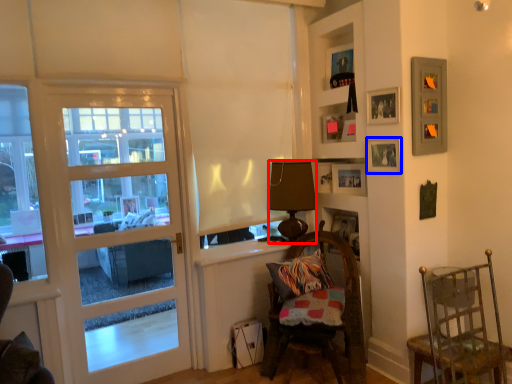
Question: Which object appears farthest to the camera in this image, lamp (highlighted by a red box) or picture frame (highlighted by a blue box)?

Choices:
 (A) lamp
 (B) picture frame

Answer: (A)